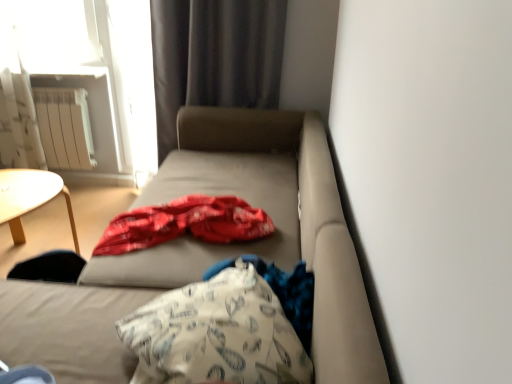
Question: Considering the relative positions of matte beige studio couch at center and white metallic radiator at upper left in the image provided, is matte beige studio couch at center behind white metallic radiator at upper left?

Choices:
 (A) yes
 (B) no

Answer: (B)

Question: From a real-world perspective, is matte beige studio couch at center located higher than white metallic radiator at upper left?

Choices:
 (A) yes
 (B) no

Answer: (B)

Question: Can you confirm if matte beige studio couch at center is positioned to the left of white metallic radiator at upper left?

Choices:
 (A) yes
 (B) no

Answer: (B)

Question: Is matte beige studio couch at center aimed at white metallic radiator at upper left?

Choices:
 (A) yes
 (B) no

Answer: (A)

Question: Can you confirm if matte beige studio couch at center is bigger than white metallic radiator at upper left?

Choices:
 (A) yes
 (B) no

Answer: (A)

Question: Considering the relative sizes of matte beige studio couch at center and white metallic radiator at upper left in the image provided, is matte beige studio couch at center wider than white metallic radiator at upper left?

Choices:
 (A) yes
 (B) no

Answer: (A)

Question: Can you confirm if white printed fabric at center is bigger than matte beige studio couch at center?

Choices:
 (A) no
 (B) yes

Answer: (A)

Question: Does white printed fabric at center have a greater height compared to matte beige studio couch at center?

Choices:
 (A) yes
 (B) no

Answer: (B)

Question: Would you say white printed fabric at center contains matte beige studio couch at center?

Choices:
 (A) yes
 (B) no

Answer: (B)

Question: Is white printed fabric at center far away from matte beige studio couch at center?

Choices:
 (A) no
 (B) yes

Answer: (A)

Question: From a real-world perspective, is white printed fabric at center under matte beige studio couch at center?

Choices:
 (A) yes
 (B) no

Answer: (B)

Question: Does white printed fabric at center have a smaller size compared to matte beige studio couch at center?

Choices:
 (A) yes
 (B) no

Answer: (A)

Question: Does matte beige studio couch at center appear on the right side of dark gray fabric curtain at upper center?

Choices:
 (A) no
 (B) yes

Answer: (A)